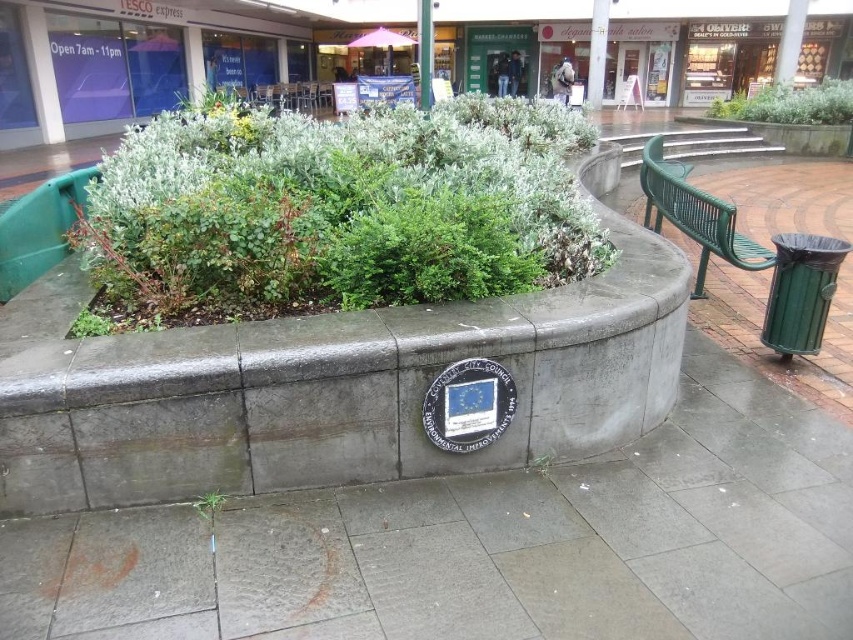
What are the coordinates of the green leafy bush at upper center?

The green leafy bush at upper center is located at coordinates point (790, 104).

You are a maintenance worker who needs to move the green metal bench at right to the storage area. Before moving, you must check if there is enough space between the bench and the green leafy bush at upper center to avoid damaging the bush. According to the scene, which direction should you move the bench to ensure the bush remains undamaged?

The green metal bench at right is positioned on the left side of the green leafy bush at upper center. To avoid damaging the bush, you should move the bench to the right side away from the bush.